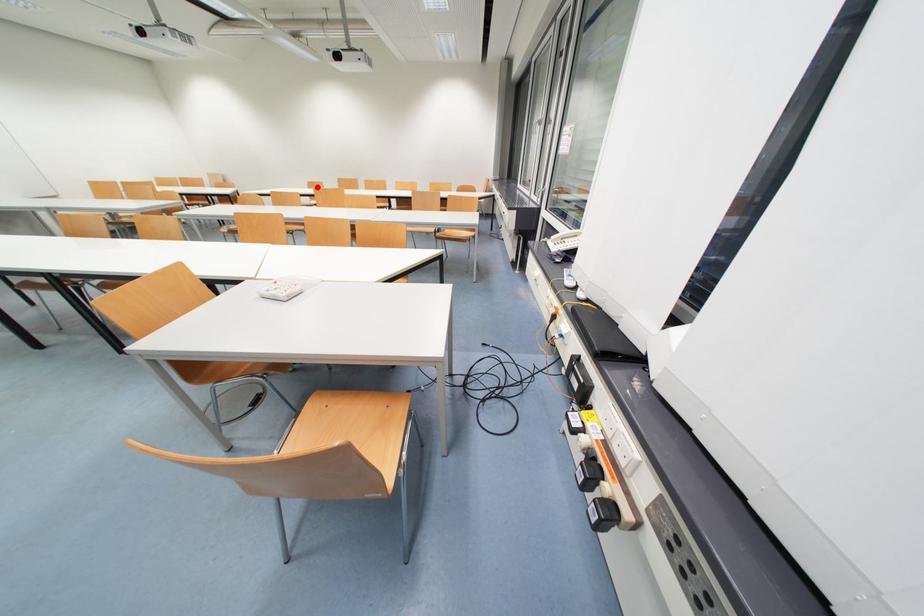
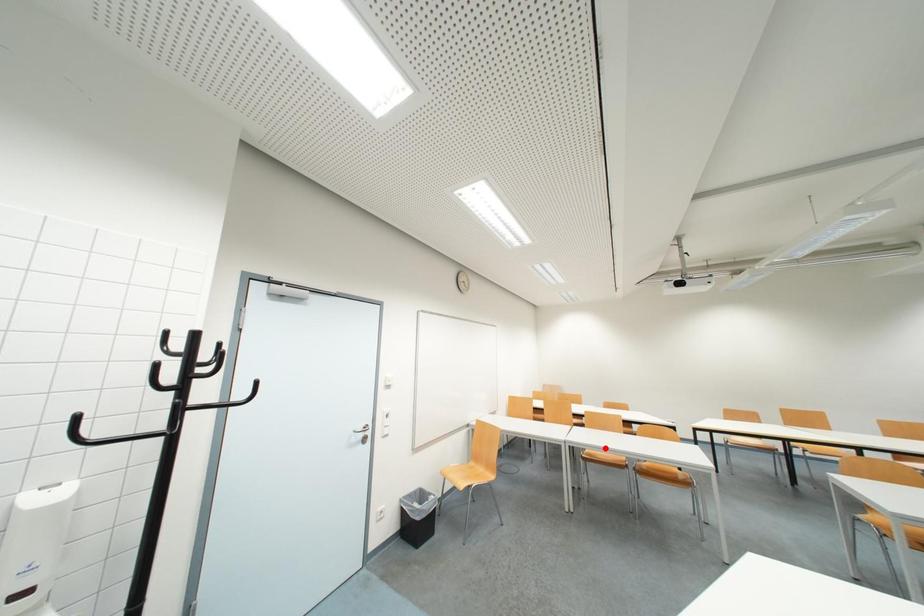
I am providing you with two images of the same scene from different viewpoints. A red point is marked on the first image and another point is marked on the second image. Is the red point in image1 aligned with the point shown in image2?

No